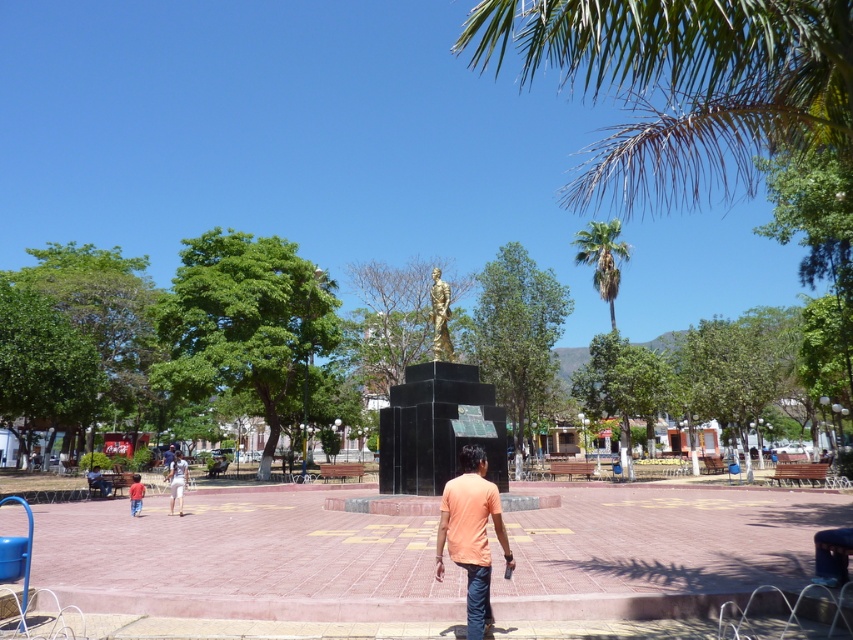
Is green leafy palm tree at upper center wider than gold polished statue at center?

Yes, green leafy palm tree at upper center is wider than gold polished statue at center.

Between point (596, 240) and point (445, 316), which one is positioned in front?

Point (445, 316) is more forward.

Is point (607, 228) more distant than point (447, 308)?

That is True.

What are the coordinates of `green leafy palm tree at upper center` in the screenshot? It's located at (602, 257).

Does orange cotton shirt at center have a lesser width compared to red cotton shirt at lower left?

In fact, orange cotton shirt at center might be wider than red cotton shirt at lower left.

Which is in front, point (450, 486) or point (141, 497)?

Point (450, 486)

Locate an element on the screen. Image resolution: width=853 pixels, height=640 pixels. orange cotton shirt at center is located at coordinates (471, 532).

Looking at this image, between orange cotton shirt at center and white cotton shorts at center, which one appears on the left side from the viewer's perspective?

Positioned to the left is white cotton shorts at center.

Can you confirm if orange cotton shirt at center is positioned below white cotton shorts at center?

Actually, orange cotton shirt at center is above white cotton shorts at center.

Is point (474, 554) behind point (178, 477)?

No, (474, 554) is closer to viewer.

Locate an element on the screen. The width and height of the screenshot is (853, 640). orange cotton shirt at center is located at coordinates (471, 532).